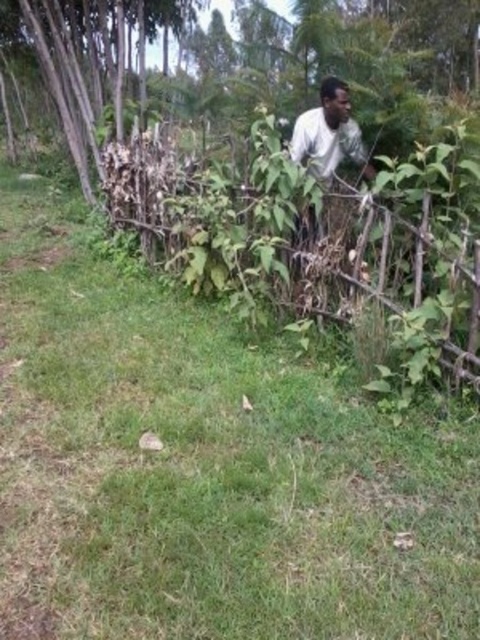
Which is more to the left, brown dry wood at left or white matte shirt at center?

brown dry wood at left

Is point (192, 1) more distant than point (317, 106)?

Yes.

Where is `brown dry wood at left`? brown dry wood at left is located at coordinates point(90,60).